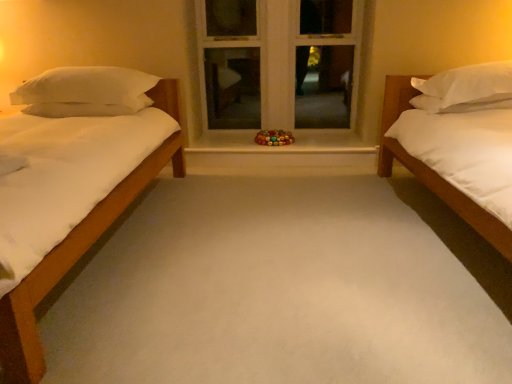
Question: Is white matte bed at right in contact with white soft pillow at right, arranged as the second pillow when viewed from the left?

Choices:
 (A) yes
 (B) no

Answer: (B)

Question: Is the position of white matte bed at right more distant than that of white soft pillow at right, arranged as the second pillow when viewed from the left?

Choices:
 (A) no
 (B) yes

Answer: (A)

Question: Is white matte bed at right wider than white soft pillow at right, arranged as the second pillow when viewed from the left?

Choices:
 (A) no
 (B) yes

Answer: (B)

Question: Is white matte bed at right not within white soft pillow at right, the first pillow from the right?

Choices:
 (A) yes
 (B) no

Answer: (A)

Question: Is white matte bed at right taller than white soft pillow at right, arranged as the second pillow when viewed from the left?

Choices:
 (A) no
 (B) yes

Answer: (B)

Question: Does white matte bed at right turn towards white soft pillow at right, the first pillow from the right?

Choices:
 (A) yes
 (B) no

Answer: (B)

Question: Considering the relative sizes of white painted wood at center and white soft pillow at left, arranged as the 1th pillow when viewed from the left, in the image provided, is white painted wood at center smaller than white soft pillow at left, arranged as the 1th pillow when viewed from the left,?

Choices:
 (A) no
 (B) yes

Answer: (A)

Question: Can you confirm if white painted wood at center is shorter than white soft pillow at left, arranged as the 1th pillow when viewed from the left?

Choices:
 (A) yes
 (B) no

Answer: (B)

Question: From the image's perspective, does white painted wood at center appear higher than white soft pillow at left, which ranks as the 2th pillow in right-to-left order?

Choices:
 (A) yes
 (B) no

Answer: (A)

Question: Considering the relative sizes of white painted wood at center and white soft pillow at left, arranged as the 1th pillow when viewed from the left, in the image provided, is white painted wood at center wider than white soft pillow at left, arranged as the 1th pillow when viewed from the left,?

Choices:
 (A) yes
 (B) no

Answer: (B)

Question: Is white painted wood at center thinner than white soft pillow at left, which ranks as the 2th pillow in right-to-left order?

Choices:
 (A) no
 (B) yes

Answer: (B)

Question: Does white painted wood at center have a greater height compared to white soft pillow at left, arranged as the 1th pillow when viewed from the left?

Choices:
 (A) yes
 (B) no

Answer: (A)

Question: Does white soft pillow at left, arranged as the 1th pillow when viewed from the left, have a smaller size compared to white matte bed at right?

Choices:
 (A) yes
 (B) no

Answer: (A)